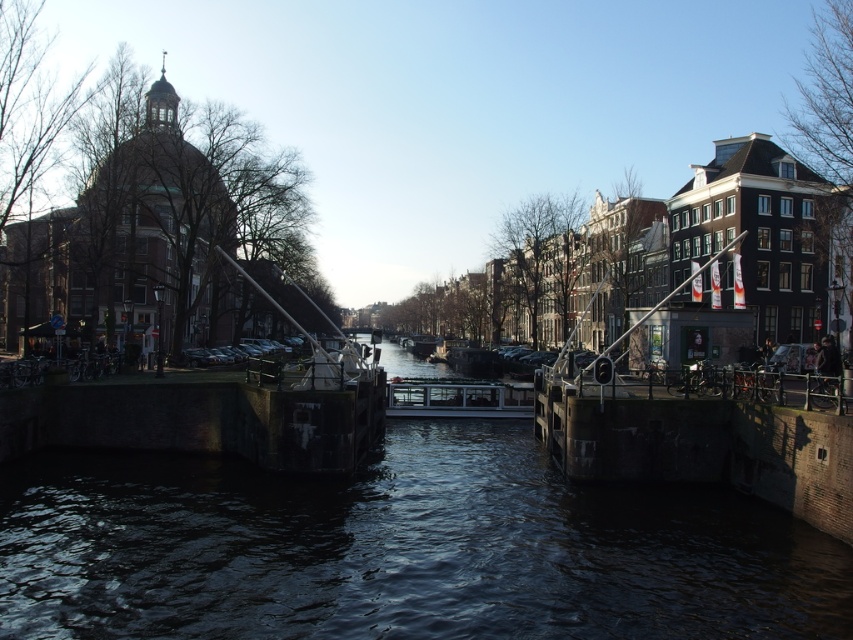
Image resolution: width=853 pixels, height=640 pixels. What do you see at coordinates (399, 548) in the screenshot? I see `dark concrete water at center` at bounding box center [399, 548].

Is dark concrete water at center bigger than metallic glass boat at center?

Yes, dark concrete water at center is bigger than metallic glass boat at center.

Does point (496, 604) come in front of point (463, 385)?

Yes, it is in front of point (463, 385).

Identify the location of dark concrete water at center. The width and height of the screenshot is (853, 640). (399, 548).